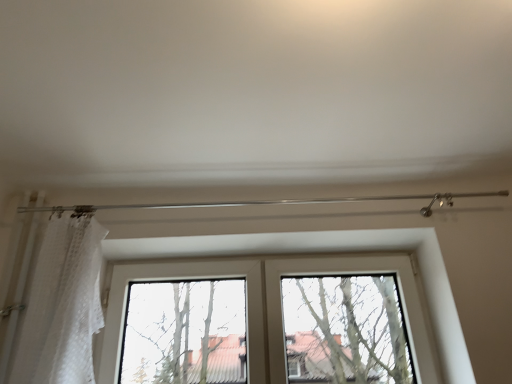
Question: In the image, is bare branches at center positioned in front of or behind white lace curtain at left?

Choices:
 (A) behind
 (B) front

Answer: (A)

Question: Based on their sizes in the image, would you say bare branches at center is bigger or smaller than white lace curtain at left?

Choices:
 (A) small
 (B) big

Answer: (B)

Question: Which object is the farthest from the white lace curtain at left?

Choices:
 (A) clear glass window at center
 (B) bare branches at center

Answer: (B)

Question: Which of these objects is positioned farthest from the white lace curtain at left?

Choices:
 (A) bare branches at center
 (B) clear glass window at center

Answer: (A)